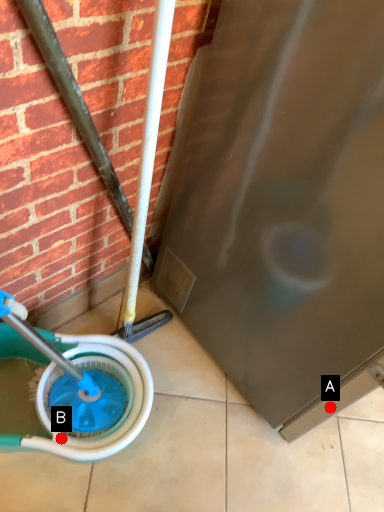
Question: Two points are circled on the image, labeled by A and B beside each circle. Among these points, which one is farthest from the camera?

Choices:
 (A) A is further
 (B) B is further

Answer: (A)